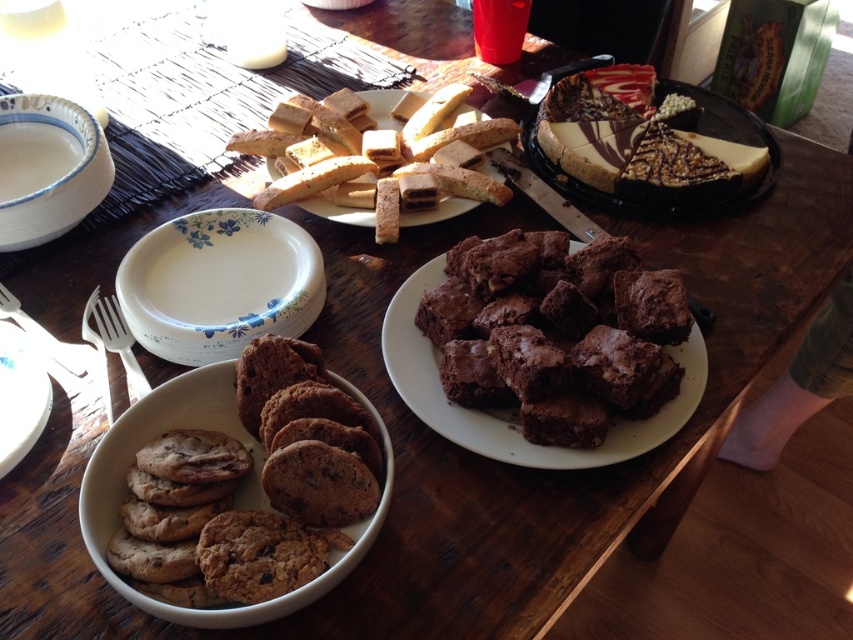
You are a guest at a dinner party and want to reach for the white ceramic plate at center and the swirled chocolate cake at center. Which one is closer to you?

The white ceramic plate at center is closer to you because it is shorter than the swirled chocolate cake at center, meaning it is positioned in front.

Where is the chocolate matte brownies at center located in the image?

The chocolate matte brownies at center is located at point (515, 410).

You are a guest at a snack table and want to reach for the chocolate matte brownies at center and the white ceramic bowl at upper left. Which item is closer to you?

The chocolate matte brownies at center is closer to you because it is in front of the white ceramic bowl at upper left.